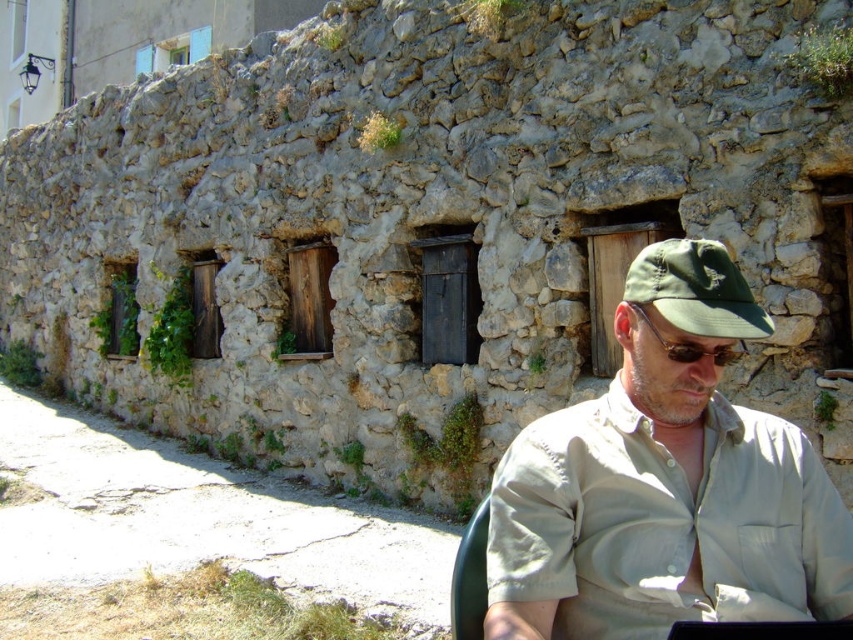
Question: Is khaki cotton shirt at center above green fabric cap at center?

Choices:
 (A) yes
 (B) no

Answer: (B)

Question: Which point is closer to the camera?

Choices:
 (A) (741, 352)
 (B) (645, 256)

Answer: (B)

Question: Which point is closer to the camera?

Choices:
 (A) khaki cotton shirt at center
 (B) green fabric cap at center

Answer: (A)

Question: Considering the relative positions of khaki cotton shirt at center and green fabric cap at center in the image provided, where is khaki cotton shirt at center located with respect to green fabric cap at center?

Choices:
 (A) below
 (B) above

Answer: (A)

Question: Considering the relative positions of khaki cotton shirt at center and green fabric cap at center in the image provided, where is khaki cotton shirt at center located with respect to green fabric cap at center?

Choices:
 (A) above
 (B) below

Answer: (B)

Question: Which point is closer to the camera?

Choices:
 (A) green fabric cap at center
 (B) khaki cotton shirt at center

Answer: (B)